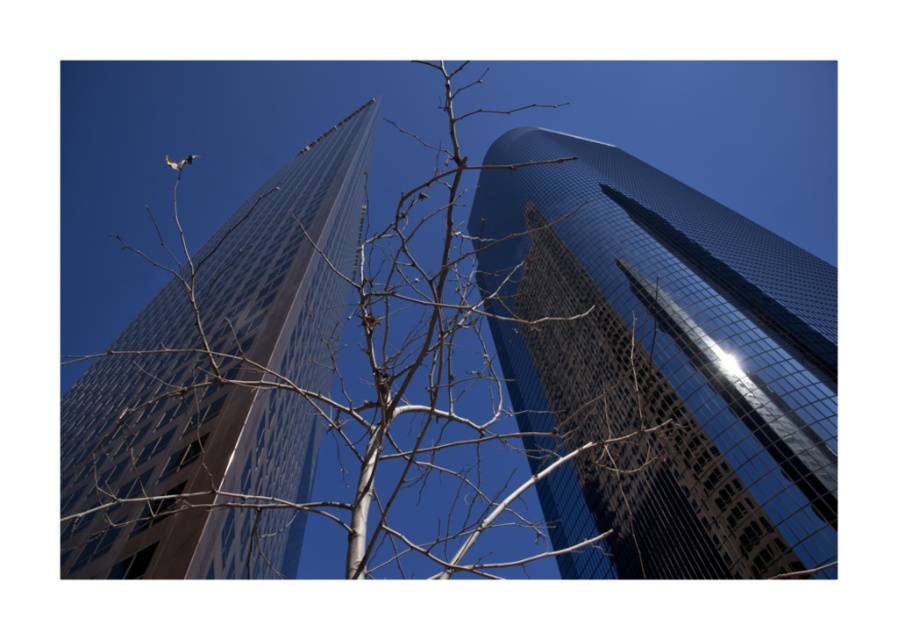
Question: Can you confirm if bare branches at center is positioned to the left of glossy glass skyscraper at center?

Choices:
 (A) no
 (B) yes

Answer: (B)

Question: Which of the following is the closest to the observer?

Choices:
 (A) (520, 355)
 (B) (166, 508)

Answer: (B)

Question: Does bare branches at center have a lesser width compared to glossy glass skyscraper at center?

Choices:
 (A) yes
 (B) no

Answer: (B)

Question: Is bare branches at center smaller than glossy glass skyscraper at center?

Choices:
 (A) yes
 (B) no

Answer: (B)

Question: Which object is positioned closest to the bare branches at center?

Choices:
 (A) glossy glass skyscraper at center
 (B) glossy glass tower at left

Answer: (B)

Question: Which of the following is the farthest from the observer?

Choices:
 (A) bare branches at center
 (B) glossy glass skyscraper at center

Answer: (B)